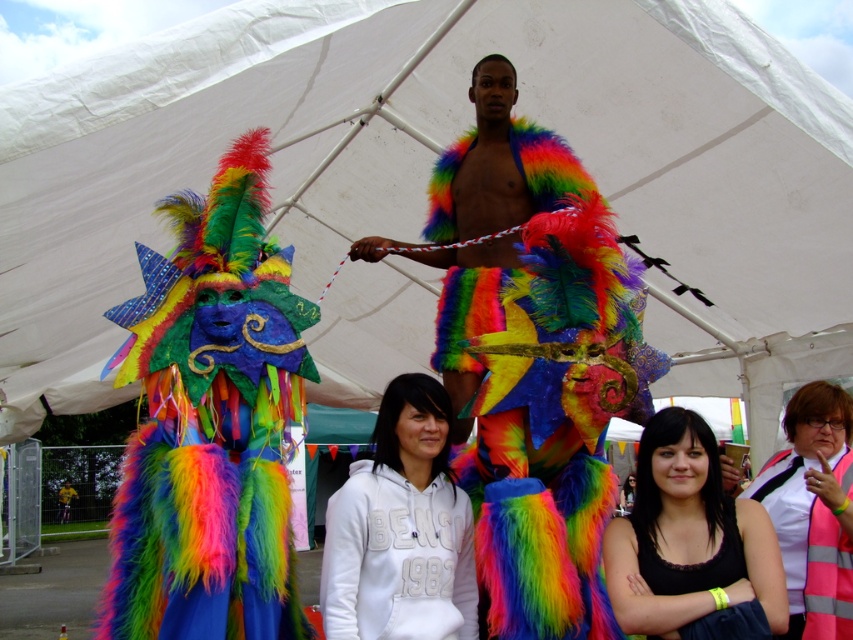
Please describe the object located at point (210,422) in the image. What is it?

The object at point (210,422) is the multicolored furry costume at left.

You are a photographer at the event and want to capture a photo that includes both the white fleece hoodie at center and the reflective silver vest at lower right. Which object should you focus on first to ensure both are in frame?

You should focus on the white fleece hoodie at center first since it is above the reflective silver vest at lower right, so by centering the camera on the hoodie, the vest will naturally fall into the lower portion of the frame.

You are standing at the center of the tent and want to move to the multicolored furry costume at left. Which direction should you face to walk straight towards it?

The multicolored furry costume at left is located at point 0.661 on the x axis and 0.247 on the y axis. Since you are at the center, you should face towards the left direction to walk straight towards it.